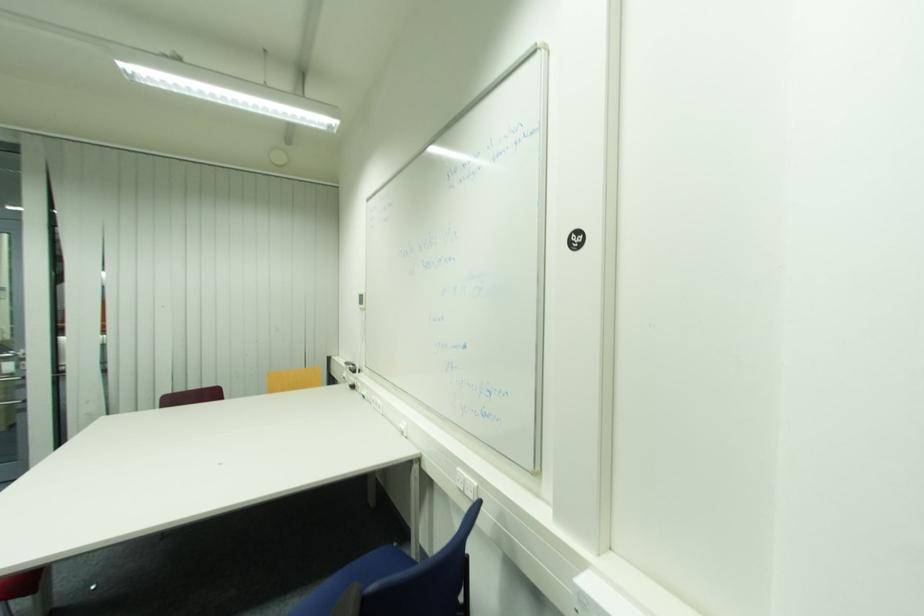
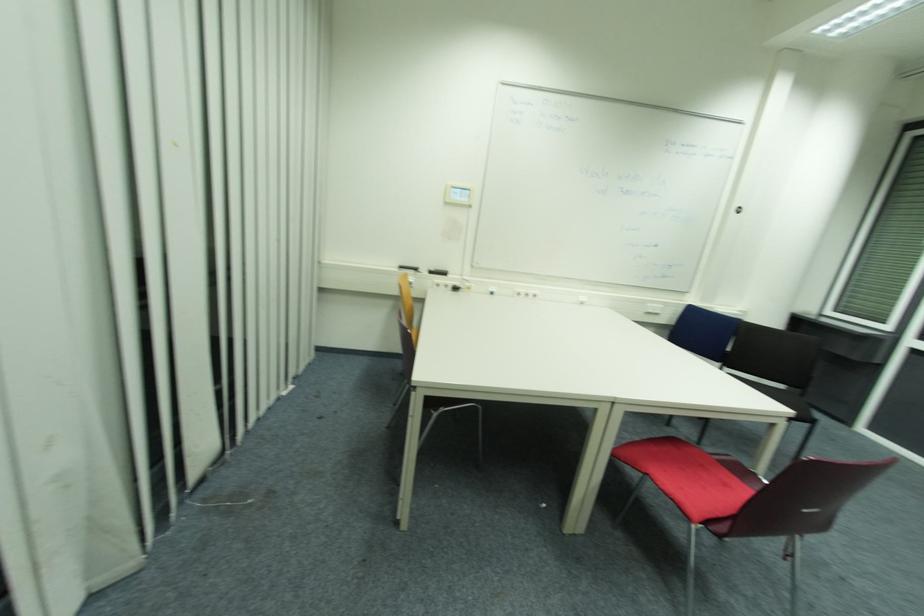
Locate, in the second image, the point that corresponds to (x=357, y=387) in the first image.

(458, 290)